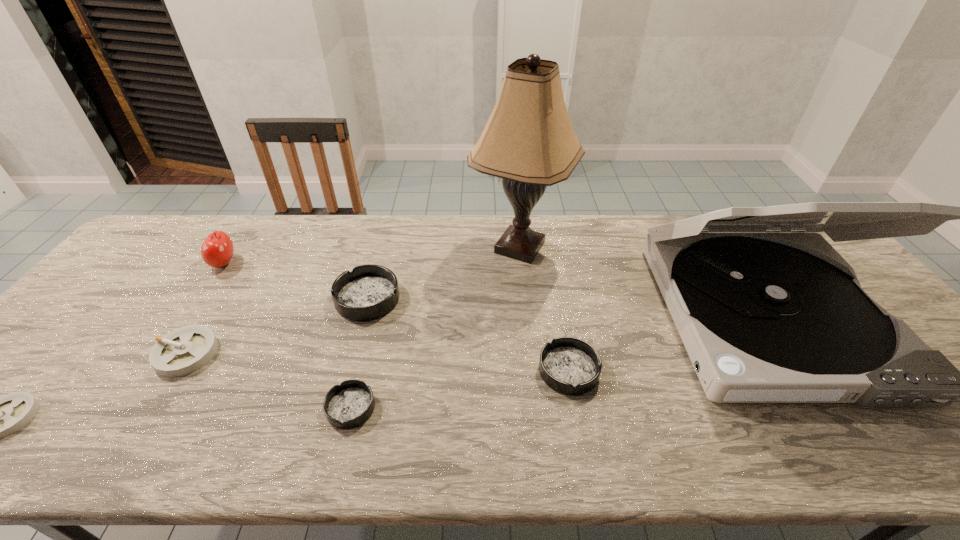
Locate an element on the screen. CD player positioned at the far edge is located at coordinates (767, 315).

Image resolution: width=960 pixels, height=540 pixels. In order to click on apple present at the far edge in this screenshot , I will do `click(217, 250)`.

At what (x,y) coordinates should I click in order to perform the action: click on object that is at the near edge. Please return your answer as a coordinate pair (x, y). Looking at the image, I should click on [348, 405].

Locate an element on the screen. Image resolution: width=960 pixels, height=540 pixels. object present at the right edge is located at coordinates (767, 315).

I want to click on object present at the far right corner, so click(767, 315).

Find the location of a particular element. The width and height of the screenshot is (960, 540). free spot at the far edge of the desktop is located at coordinates (341, 234).

Identify the location of blank area at the near edge. The width and height of the screenshot is (960, 540). (576, 426).

Where is `vacant space in between the fourth tallest object and the apple`? The height and width of the screenshot is (540, 960). vacant space in between the fourth tallest object and the apple is located at coordinates (296, 281).

You are a GUI agent. You are given a task and a screenshot of the screen. Output one action in this format:
    pyautogui.click(x=<x>, y=<y>)
    Task: Click on the vacant space that is in between the bigger gray ashtray and the apple
    
    Given the screenshot: What is the action you would take?
    pyautogui.click(x=205, y=308)

Find the location of a particular element. The image size is (960, 540). vacant area that lies between the tallest object and the farthest ashtray is located at coordinates (444, 273).